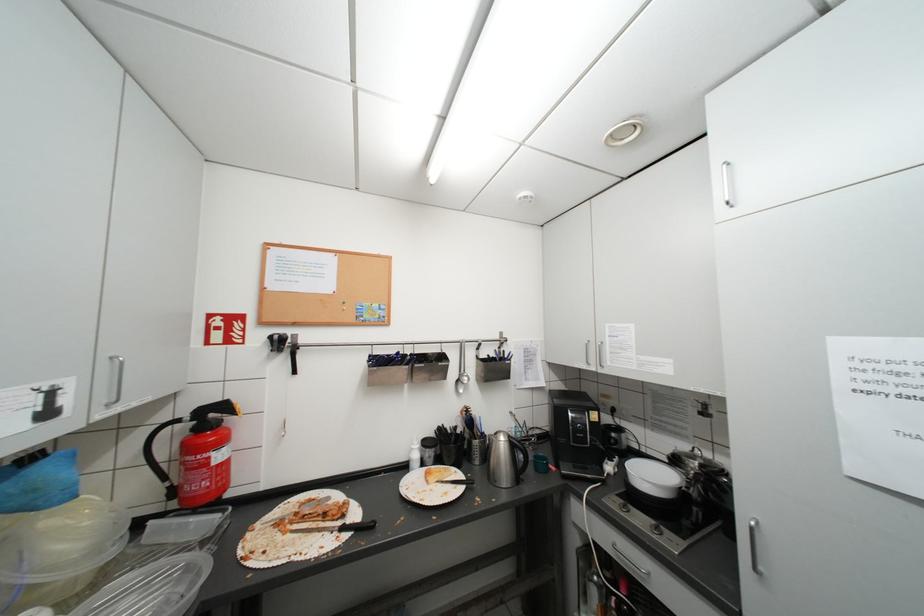
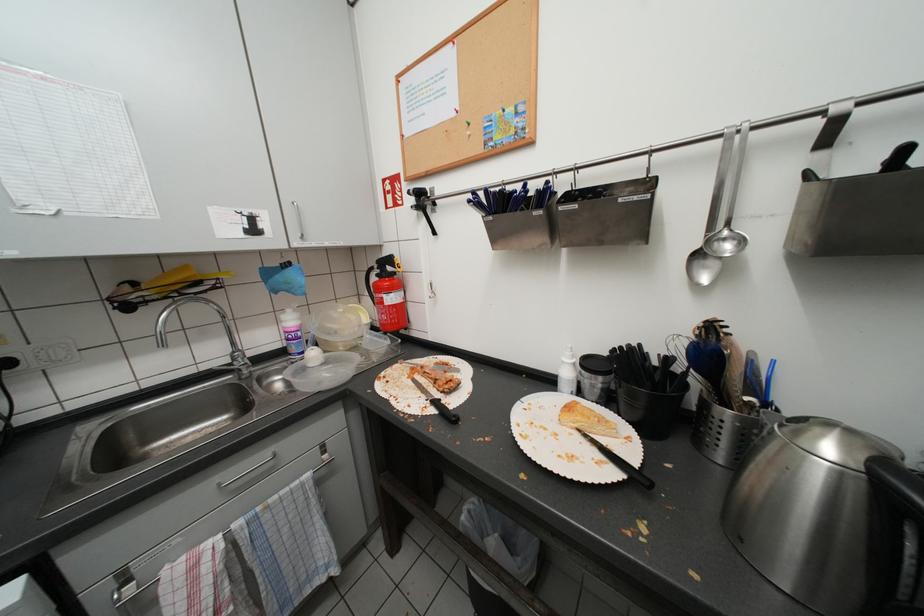
The images are taken continuously from a first-person perspective. In which direction is your viewpoint rotating?

The rotation direction of the camera is left-down.